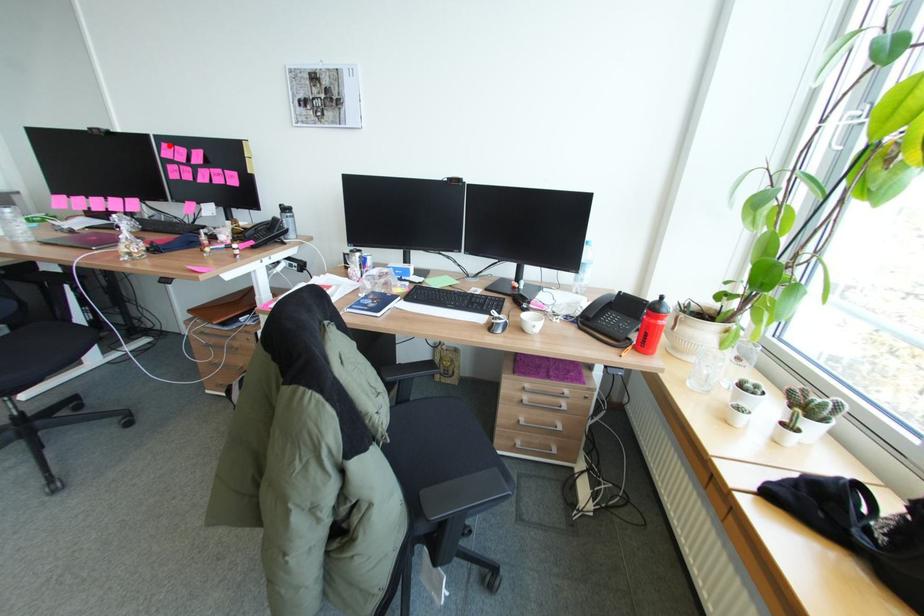
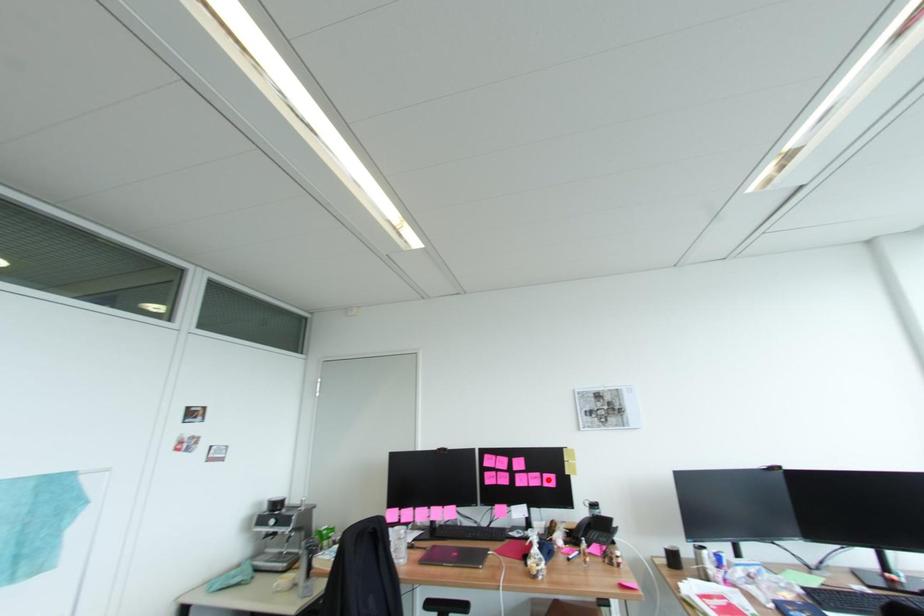
Based on the photo, I am providing you with two images of the same scene from different viewpoints. A red point is marked on the first image and another point is marked on the second image. Is the red point in image1 aligned with the point shown in image2?

No